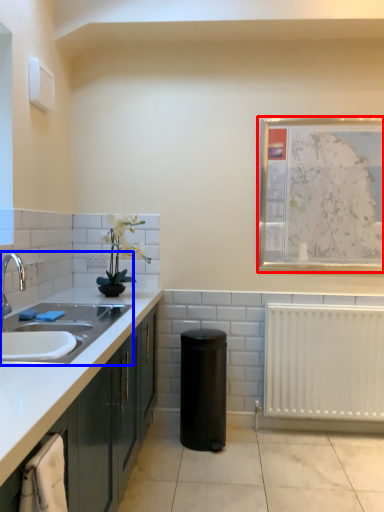
Question: Which object appears closest to the camera in this image, picture frame (highlighted by a red box) or sink (highlighted by a blue box)?

Choices:
 (A) picture frame
 (B) sink

Answer: (B)